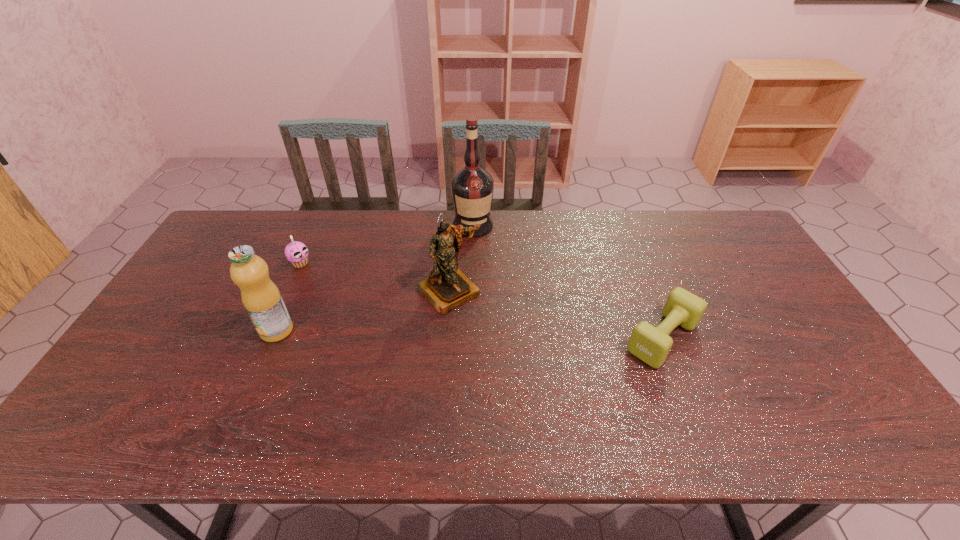
The image size is (960, 540). In the image, there is a desktop. Identify the location of vacant space at the near edge. (710, 393).

Locate an element on the screen. Image resolution: width=960 pixels, height=540 pixels. vacant space at the left edge of the desktop is located at coordinates (201, 262).

Where is `vacant space at the right edge`? Image resolution: width=960 pixels, height=540 pixels. vacant space at the right edge is located at coordinates (783, 362).

In the image, there is a desktop. In order to click on free space at the far left corner in this screenshot , I will do `click(242, 228)`.

Locate an element on the screen. This screenshot has width=960, height=540. vacant position at the near left corner of the desktop is located at coordinates (162, 395).

Locate an element on the screen. The width and height of the screenshot is (960, 540). blank space at the far right corner of the desktop is located at coordinates point(726,250).

Locate an element on the screen. The height and width of the screenshot is (540, 960). free spot between the dumbbell and the fruit juice is located at coordinates (469, 334).

At what (x,y) coordinates should I click in order to perform the action: click on free space that is in between the cupcake and the fruit juice. Please return your answer as a coordinate pair (x, y). Image resolution: width=960 pixels, height=540 pixels. Looking at the image, I should click on (289, 296).

Identify the location of free space between the figurine and the rightmost object. This screenshot has width=960, height=540. (556, 314).

Locate an element on the screen. empty space that is in between the liquor and the fruit juice is located at coordinates (375, 278).